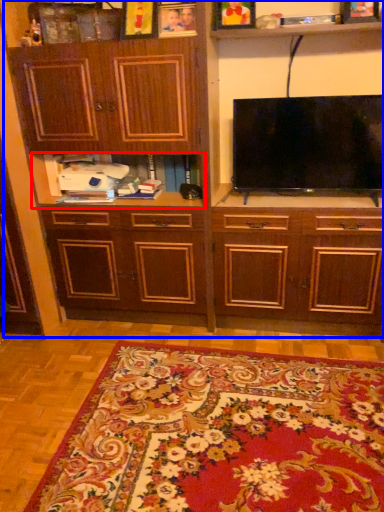
Question: Which object is further to the camera taking this photo, shelf (highlighted by a red box) or cabinetry (highlighted by a blue box)?

Choices:
 (A) shelf
 (B) cabinetry

Answer: (A)